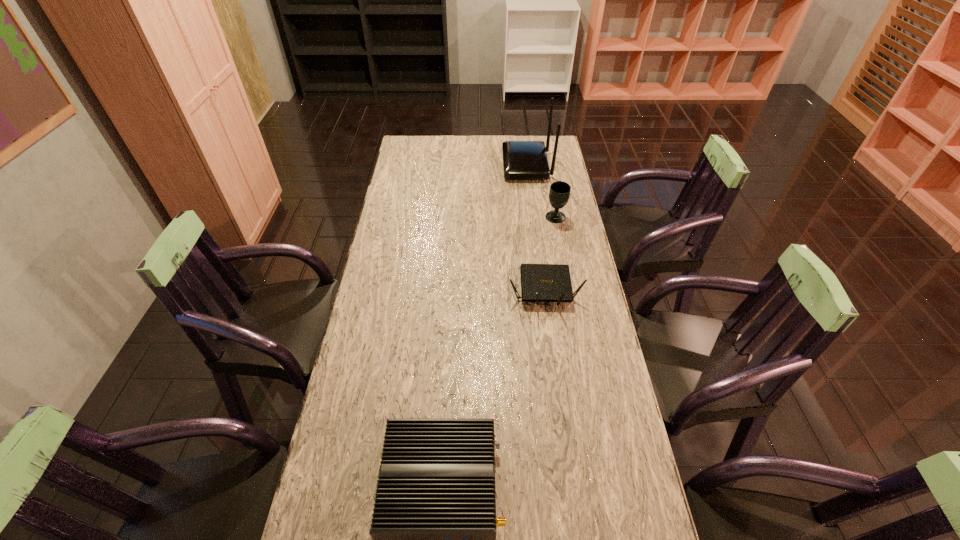
Image resolution: width=960 pixels, height=540 pixels. What are the coordinates of `object that is at the far edge` in the screenshot? It's located at (522, 160).

You are a GUI agent. You are given a task and a screenshot of the screen. Output one action in this format:
    pyautogui.click(x=<x>, y=<y>)
    Task: Click on the chalice located in the right edge section of the desktop
    This screenshot has height=540, width=960.
    Given the screenshot: What is the action you would take?
    point(559,193)

This screenshot has height=540, width=960. What are the coordinates of `object that is at the far right corner` in the screenshot? It's located at (522, 160).

Locate an element on the screen. free space at the far edge of the desktop is located at coordinates (437, 142).

The height and width of the screenshot is (540, 960). In order to click on free space at the left edge in this screenshot , I will do `click(400, 191)`.

Find the location of a particular element. vacant space at the right edge of the desktop is located at coordinates point(575,407).

Locate an element on the screen. vacant region at the far left corner of the desktop is located at coordinates (423, 144).

Locate an element on the screen. This screenshot has height=540, width=960. empty space that is in between the second farthest router and the farthest object is located at coordinates (536, 228).

What are the coordinates of `vacant space that's between the chalice and the second farthest router` in the screenshot? It's located at (550, 254).

The height and width of the screenshot is (540, 960). Find the location of `vacant region between the third nearest object and the second nearest router`. vacant region between the third nearest object and the second nearest router is located at coordinates (550, 254).